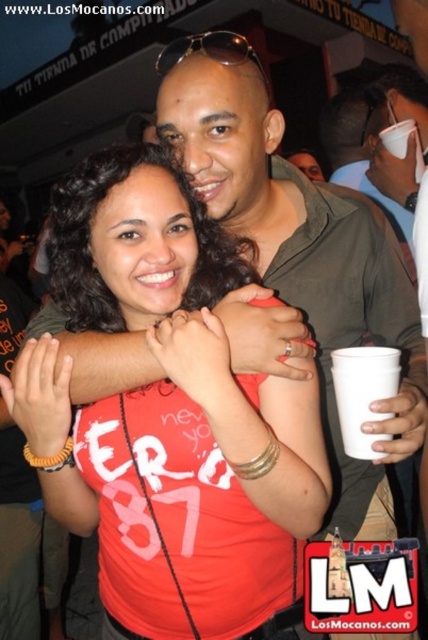
Question: Can you confirm if matte red shirt at center is positioned to the right of white plastic cup at right?

Choices:
 (A) yes
 (B) no

Answer: (B)

Question: Which point is closer to the camera?

Choices:
 (A) matte red shirt at center
 (B) white plastic cup at right

Answer: (A)

Question: Which of the following is the closest to the observer?

Choices:
 (A) white plastic cup at right
 (B) matte red shirt at center

Answer: (B)

Question: Considering the relative positions of matte red shirt at center and white plastic cup at right in the image provided, where is matte red shirt at center located with respect to white plastic cup at right?

Choices:
 (A) right
 (B) left

Answer: (B)

Question: Is matte red shirt at center above white plastic cup at right?

Choices:
 (A) yes
 (B) no

Answer: (B)